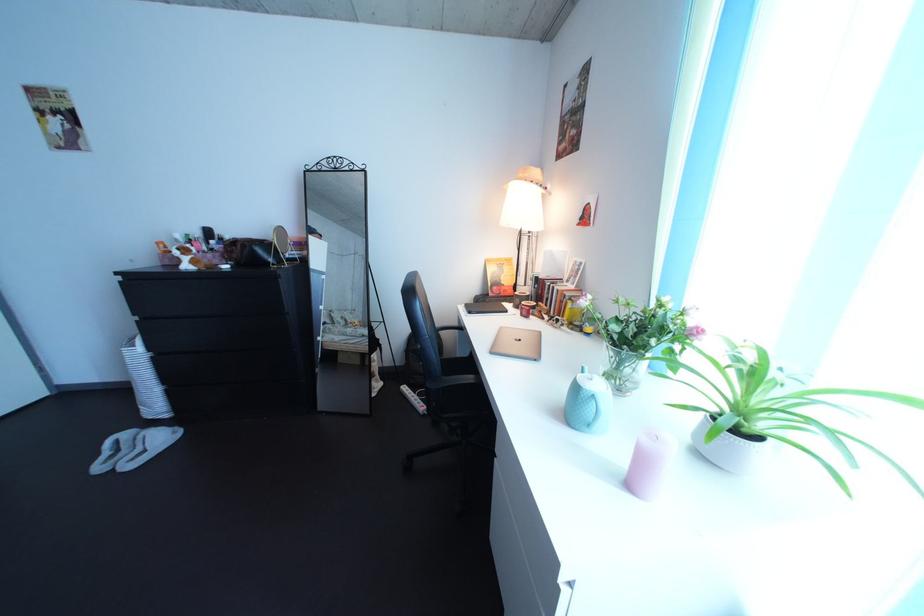
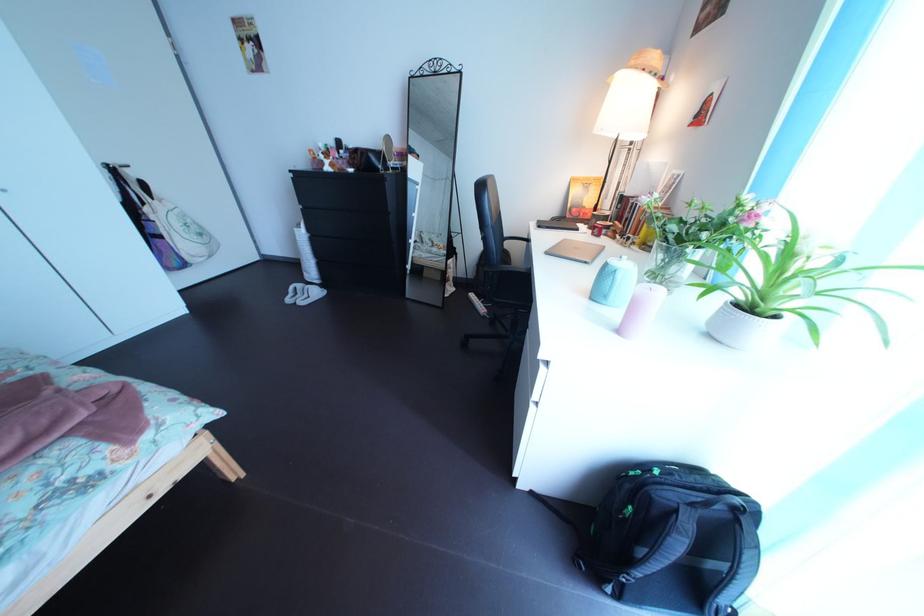
Locate, in the second image, the point that corresponds to pixel 603 434 in the first image.

(621, 305)